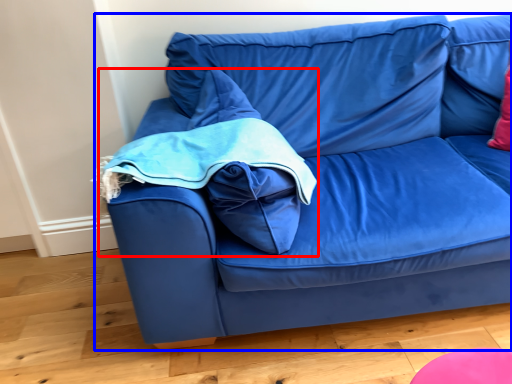
Question: Which point is further to the camera, bean bag chair (highlighted by a red box) or studio couch (highlighted by a blue box)?

Choices:
 (A) bean bag chair
 (B) studio couch

Answer: (A)